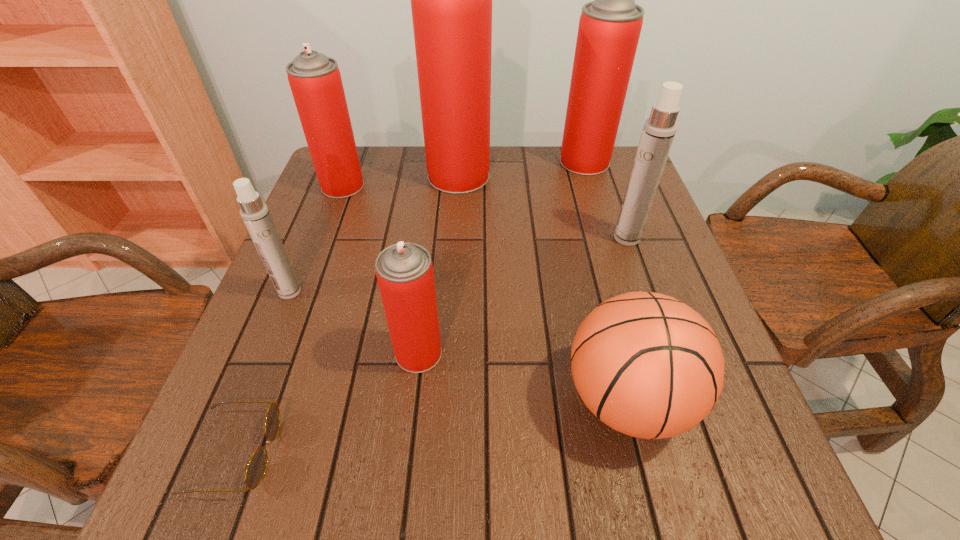
The height and width of the screenshot is (540, 960). What are the coordinates of `vacant point that satisfies the following two spatial constraints: 1. on the front side of the fifth shortest aerosol can; 2. on the left side of the bigger white aerosol can` in the screenshot? It's located at (608, 238).